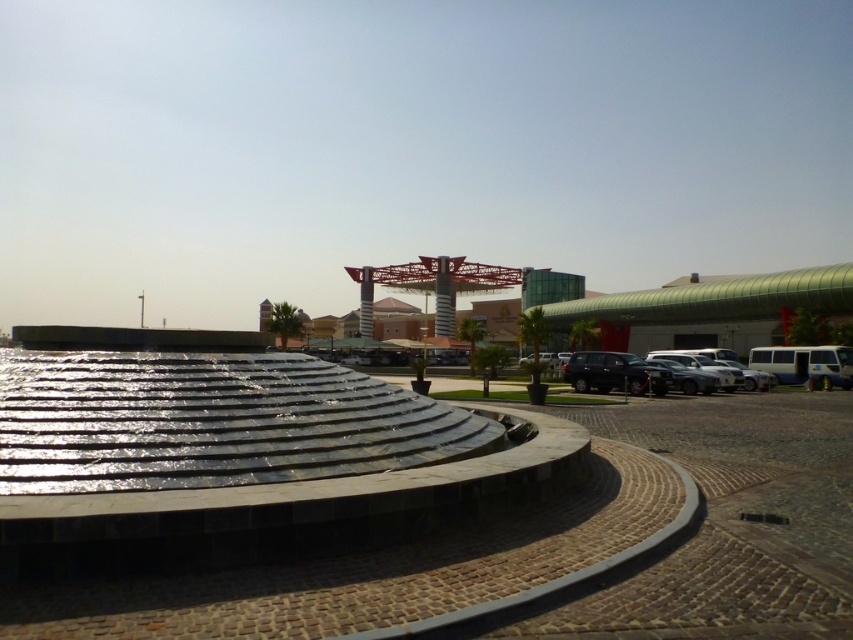
Question: Which of the following is the closest to the observer?

Choices:
 (A) shiny black suv at center
 (B) metallic glass mall at center

Answer: (A)

Question: Where is metallic glass mall at center located in relation to shiny black suv at center in the image?

Choices:
 (A) above
 (B) below

Answer: (A)

Question: Is metallic glass mall at center above shiny black suv at center?

Choices:
 (A) no
 (B) yes

Answer: (B)

Question: Is metallic glass mall at center wider than shiny black suv at center?

Choices:
 (A) no
 (B) yes

Answer: (B)

Question: Which point is closer to the camera taking this photo?

Choices:
 (A) (669, 372)
 (B) (666, 317)

Answer: (A)